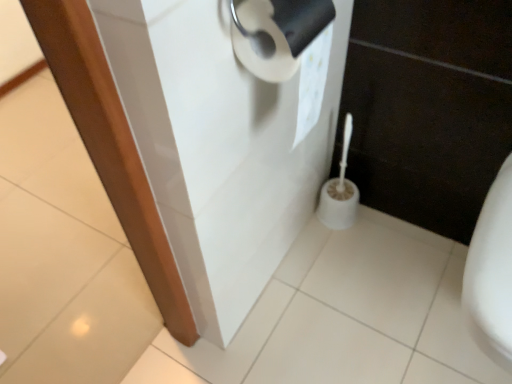
You are a GUI agent. You are given a task and a screenshot of the screen. Output one action in this format:
    pyautogui.click(x=<x>, y=<y>)
    Task: Click on the white matte toilet paper at upper center
    The height and width of the screenshot is (384, 512).
    Given the screenshot: What is the action you would take?
    (276, 33)

The height and width of the screenshot is (384, 512). What do you see at coordinates (276, 33) in the screenshot? I see `white matte toilet paper at upper center` at bounding box center [276, 33].

I want to click on white matte toilet paper at upper center, so (276, 33).